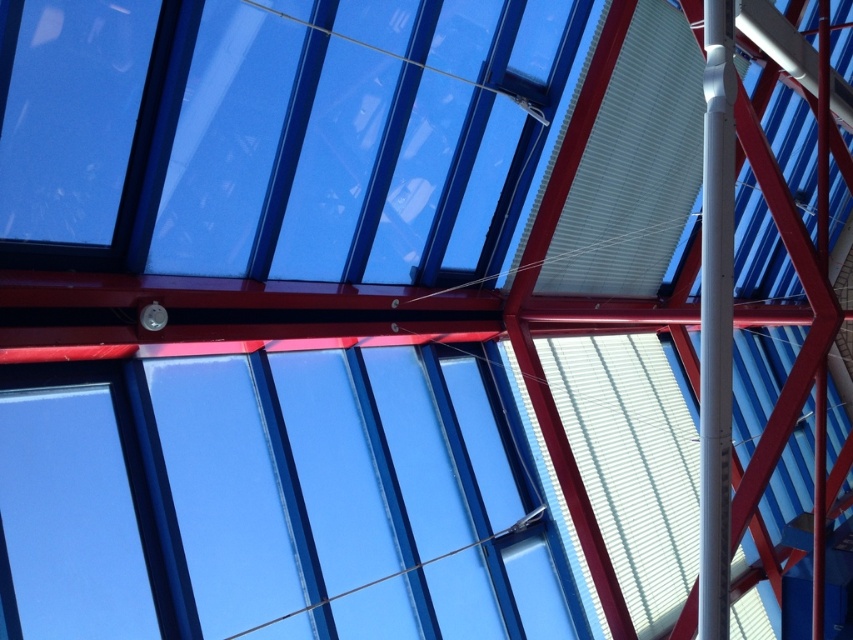
In the scene shown: You are an interior designer planning to install a new light fixture. You see the transparent glass window at center and the white glossy pole at center. Which object should you consider in terms of size when choosing the appropriate light fixture to ensure it complements the space?

The transparent glass window at center is larger in size than the white glossy pole at center, so you should consider the size of the transparent glass window at center to ensure the light fixture complements the space appropriately.

You are standing in a room with a modern ceiling structure. You notice a point marked at coordinates (341, 499). What object is located at this point?

The transparent glass window at center is located at point (341, 499).